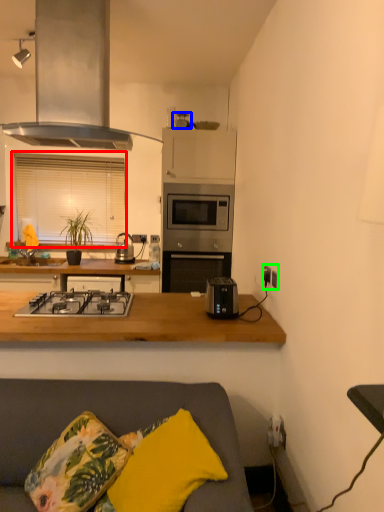
Question: Based on their relative distances, which object is farther from window (highlighted by a red box)? Choose from appliance (highlighted by a blue box) and electric outlet (highlighted by a green box).

Choices:
 (A) appliance
 (B) electric outlet

Answer: (B)